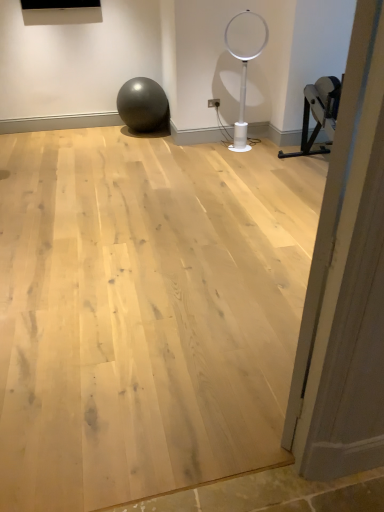
The image size is (384, 512). I want to click on vacant space behind wooden door at right, so click(267, 323).